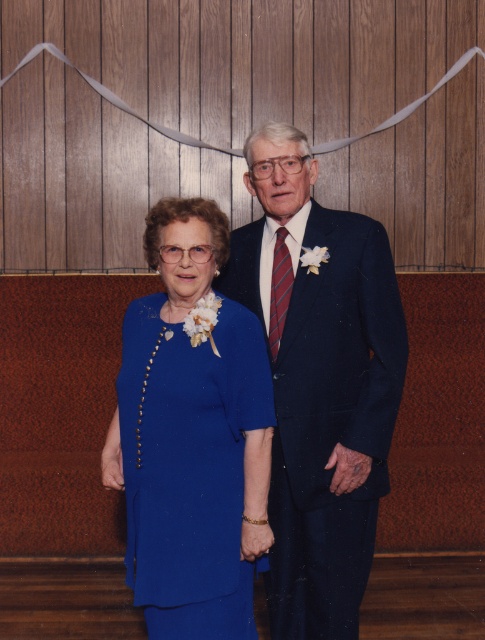
From the picture: You are a photographer setting up for a group photo. You notice the navy wool suit at center and the matte blue dress at center. Which one is closer to you?

The navy wool suit at center is closer to you since it is further to the viewer than the matte blue dress at center.

You are a photographer preparing to take a group photo. You have two subjects wearing the navy wool suit at center and the matte blue dress at center. Based on their clothing sizes, which subject should you position closer to the camera to create a balanced composition?

The navy wool suit at center is larger in size compared to the matte blue dress at center. To create a balanced composition, position the person wearing the smaller matte blue dress at center closer to the camera to visually balance the size difference.